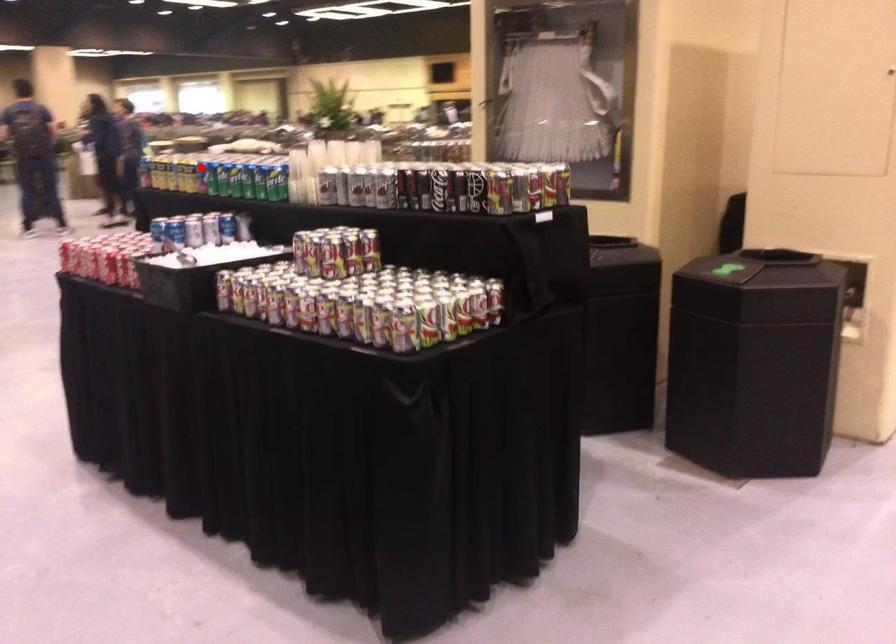
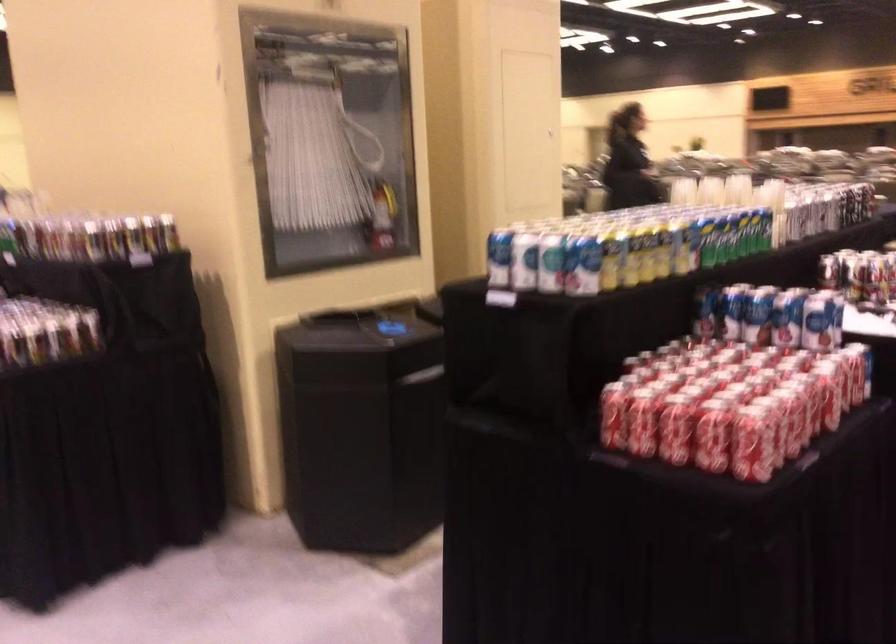
Question: I am providing you with two images of the same scene from different viewpoints. Image1 has a red point marked. In image2, the corresponding 3D location appears at what relative position? Reply with the corresponding letter.

Choices:
 (A) Closer
 (B) Farther

Answer: (A)